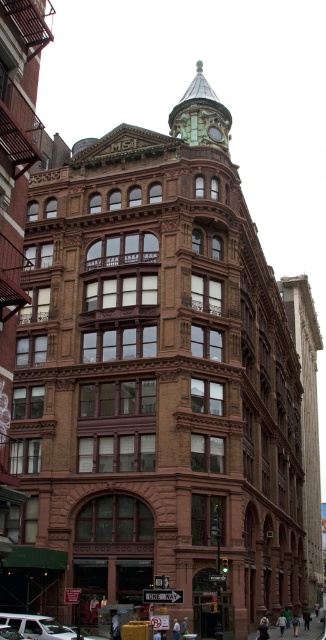
Question: Does white matte van at lower left appear over green glass clock at upper center?

Choices:
 (A) no
 (B) yes

Answer: (A)

Question: Is white matte van at lower left below green glass clock at upper center?

Choices:
 (A) no
 (B) yes

Answer: (B)

Question: Which object appears closest to the camera in this image?

Choices:
 (A) white matte van at lower left
 (B) green glass clock at upper center

Answer: (A)

Question: Which of the following is the farthest from the observer?

Choices:
 (A) white matte van at lower left
 (B) green glass clock at upper center

Answer: (B)

Question: Which point is closer to the camera taking this photo?

Choices:
 (A) (55, 624)
 (B) (213, 131)

Answer: (A)

Question: Is white matte van at lower left further to camera compared to green glass clock at upper center?

Choices:
 (A) yes
 (B) no

Answer: (B)